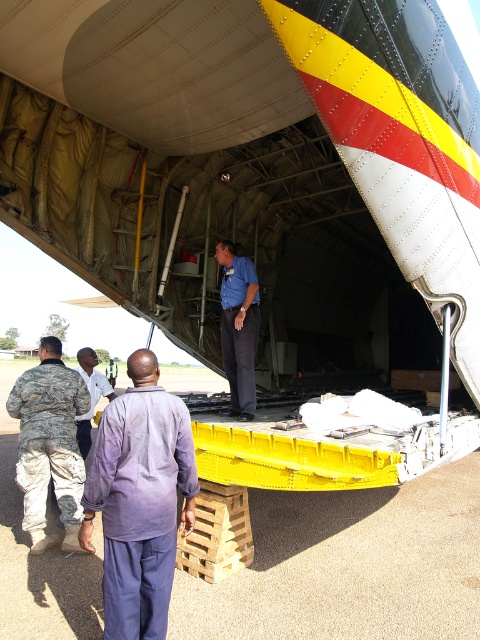
Does purple cotton shirt at center appear over blue shirt at center?

Actually, purple cotton shirt at center is below blue shirt at center.

Between point (129, 516) and point (252, 300), which one is positioned behind?

The point (252, 300) is more distant.

Locate an element on the screen. This screenshot has width=480, height=640. purple cotton shirt at center is located at coordinates (140, 499).

Between camouflage fabric uniform at left and light purple shirt at center, which one is positioned higher?

Positioned higher is camouflage fabric uniform at left.

Locate an element on the screen. The height and width of the screenshot is (640, 480). camouflage fabric uniform at left is located at coordinates (49, 444).

Who is higher up, purple cotton shirt at center or light purple shirt at center?

light purple shirt at center is higher up.

Between point (147, 449) and point (75, 416), which one is positioned behind?

The point (75, 416) is behind.

Between point (130, 374) and point (101, 388), which one is positioned behind?

The point (101, 388) is more distant.

This screenshot has height=640, width=480. I want to click on purple cotton shirt at center, so click(140, 499).